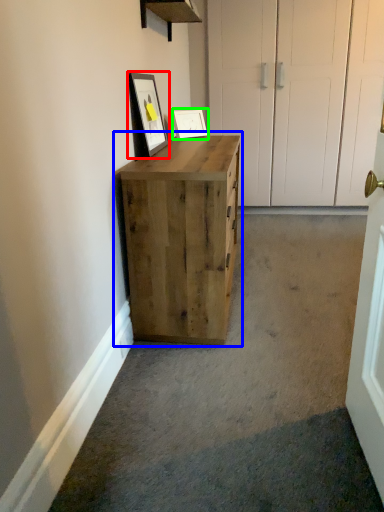
Question: Estimate the real-world distances between objects in this image. Which object is closer to picture frame (highlighted by a red box), chest of drawers (highlighted by a blue box) or picture frame (highlighted by a green box)?

Choices:
 (A) chest of drawers
 (B) picture frame

Answer: (B)